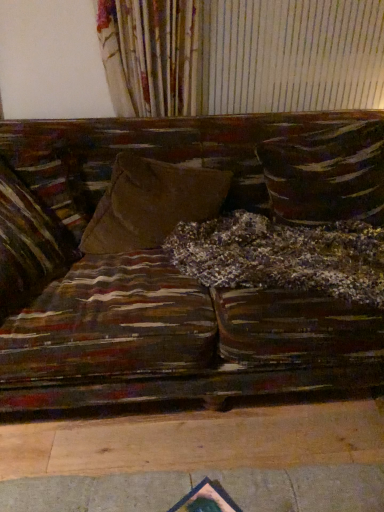
Question: Could textured brown pillow at center, the 1th pillow in the right-to-left sequence, be considered to be inside velvet brown pillow at left, positioned as the 3th pillow in right-to-left order?

Choices:
 (A) no
 (B) yes

Answer: (A)

Question: Is velvet brown pillow at left, positioned as the 3th pillow in right-to-left order, completely or partially outside of textured brown pillow at center, the 1th pillow in the right-to-left sequence?

Choices:
 (A) yes
 (B) no

Answer: (A)

Question: Considering the relative sizes of velvet brown pillow at left, positioned as the 3th pillow in right-to-left order, and textured brown pillow at center, the 3th pillow positioned from the left, in the image provided, is velvet brown pillow at left, positioned as the 3th pillow in right-to-left order, smaller than textured brown pillow at center, the 3th pillow positioned from the left,?

Choices:
 (A) no
 (B) yes

Answer: (B)

Question: From the image's perspective, is velvet brown pillow at left, the 1th pillow positioned from the left, above textured brown pillow at center, the 1th pillow in the right-to-left sequence?

Choices:
 (A) yes
 (B) no

Answer: (B)

Question: From a real-world perspective, is velvet brown pillow at left, positioned as the 3th pillow in right-to-left order, under textured brown pillow at center, the 3th pillow positioned from the left?

Choices:
 (A) yes
 (B) no

Answer: (B)

Question: Does point (140, 226) appear closer or farther from the camera than point (52, 236)?

Choices:
 (A) farther
 (B) closer

Answer: (A)

Question: In the image, is suede-like brown pillow at center, the second pillow when ordered from right to left, positioned in front of or behind velvet brown pillow at left, the 1th pillow positioned from the left?

Choices:
 (A) front
 (B) behind

Answer: (B)

Question: From the image's perspective, is suede-like brown pillow at center, the second pillow when ordered from right to left, above or below velvet brown pillow at left, positioned as the 3th pillow in right-to-left order?

Choices:
 (A) above
 (B) below

Answer: (A)

Question: Considering the positions of suede-like brown pillow at center, the second pillow when ordered from right to left, and velvet brown pillow at left, positioned as the 3th pillow in right-to-left order, in the image, is suede-like brown pillow at center, the second pillow when ordered from right to left, bigger or smaller than velvet brown pillow at left, positioned as the 3th pillow in right-to-left order,?

Choices:
 (A) small
 (B) big

Answer: (B)

Question: From a real-world perspective, is textured brown pillow at center, the 1th pillow in the right-to-left sequence, physically located above or below suede-like brown pillow at center, which is the 2th pillow from left to right?

Choices:
 (A) below
 (B) above

Answer: (B)

Question: Is point (357, 190) positioned closer to the camera than point (122, 217)?

Choices:
 (A) closer
 (B) farther

Answer: (B)

Question: In terms of height, does textured brown pillow at center, the 1th pillow in the right-to-left sequence, look taller or shorter compared to suede-like brown pillow at center, the second pillow when ordered from right to left?

Choices:
 (A) short
 (B) tall

Answer: (B)

Question: Looking at their shapes, would you say textured brown pillow at center, the 3th pillow positioned from the left, is wider or thinner than suede-like brown pillow at center, the second pillow when ordered from right to left?

Choices:
 (A) thin
 (B) wide

Answer: (A)

Question: Is suede-like brown pillow at center, which is the 2th pillow from left to right, taller or shorter than textured brown pillow at center, the 1th pillow in the right-to-left sequence?

Choices:
 (A) tall
 (B) short

Answer: (B)

Question: Is suede-like brown pillow at center, which is the 2th pillow from left to right, inside or outside of textured brown pillow at center, the 1th pillow in the right-to-left sequence?

Choices:
 (A) outside
 (B) inside

Answer: (A)